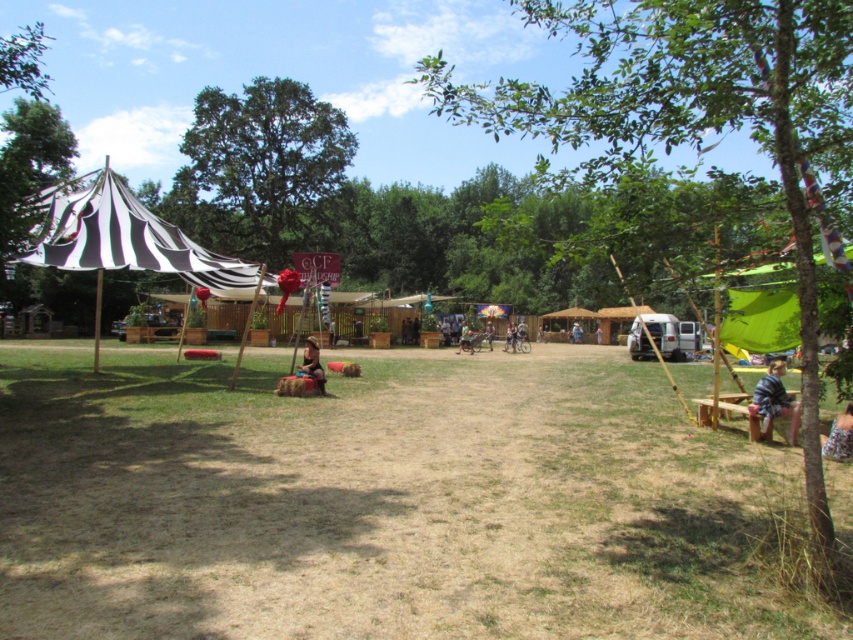
Question: Does green leafy tree at center appear under brown fabric cushion at center?

Choices:
 (A) no
 (B) yes

Answer: (A)

Question: Among these objects, which one is nearest to the camera?

Choices:
 (A) denim shorts at lower right
 (B) blue striped shirt at lower right

Answer: (A)

Question: Does brown fabric cushion at center have a greater width compared to leather jacket at center?

Choices:
 (A) yes
 (B) no

Answer: (A)

Question: Estimate the real-world distances between objects in this image. Which object is closer to the green leafy tree at center?

Choices:
 (A) brown fabric cushion at center
 (B) green leafy tree at center right
 (C) brown dry grass at center

Answer: (B)

Question: Does brown fabric cushion at center have a lesser width compared to denim shorts at lower right?

Choices:
 (A) no
 (B) yes

Answer: (A)

Question: Which of the following is the closest to the observer?

Choices:
 (A) (9, 45)
 (B) (576, 333)
 (C) (318, 369)
 (D) (822, 452)

Answer: (D)